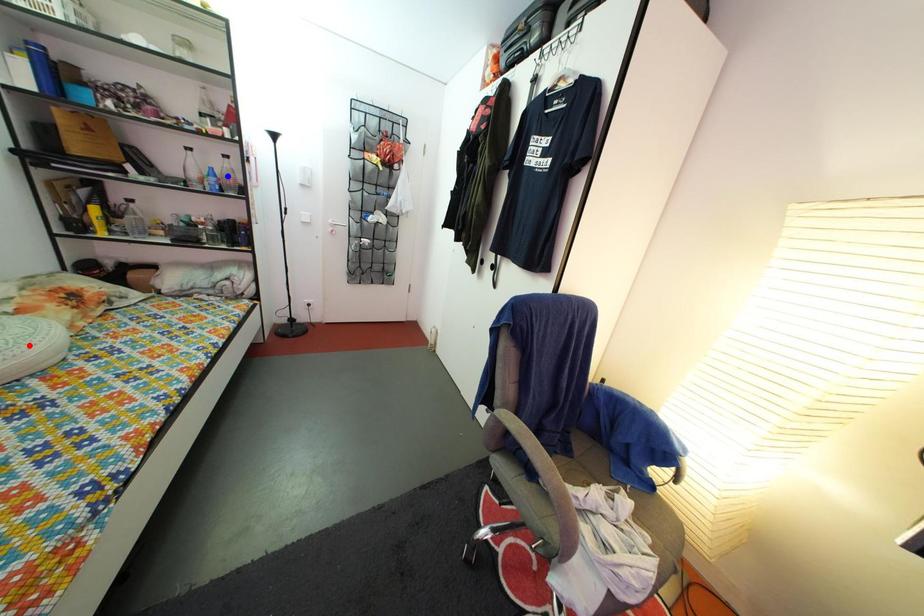
Question: Which of the two points in the image is closer to the camera?

Choices:
 (A) Blue point is closer.
 (B) Red point is closer.

Answer: (B)